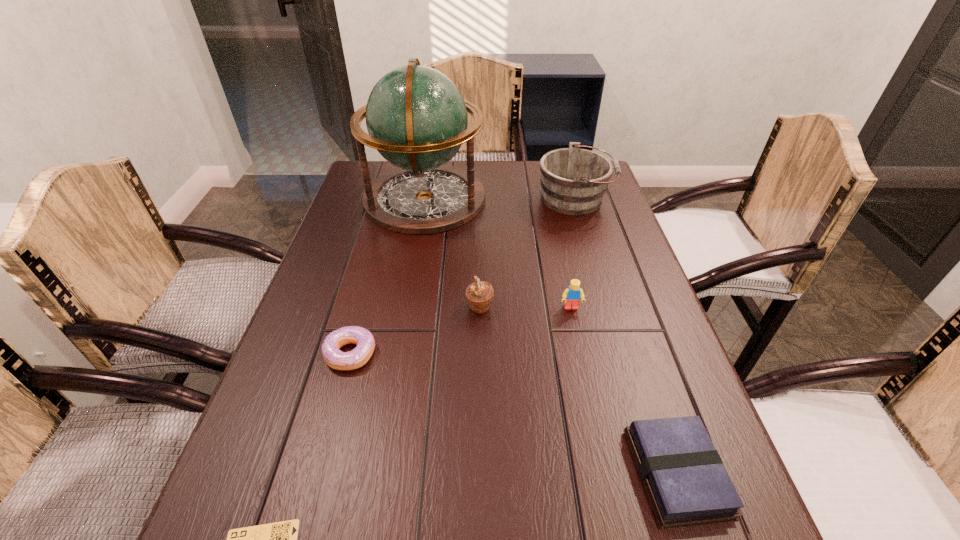
The image size is (960, 540). Find the location of `free area in between the book and the doughnut`. free area in between the book and the doughnut is located at coordinates (x=514, y=413).

Identify the location of free space between the fifth farthest object and the globe. The height and width of the screenshot is (540, 960). (388, 276).

The width and height of the screenshot is (960, 540). I want to click on vacant point located between the muffin and the tallest object, so click(x=452, y=253).

Identify the location of the sixth closest object to the identity card. This screenshot has height=540, width=960. (573, 180).

This screenshot has width=960, height=540. Identify the location of object that can be found as the closest to the identity card. (359, 356).

The height and width of the screenshot is (540, 960). I want to click on vacant space that satisfies the following two spatial constraints: 1. on the front-facing side of the Lego; 2. on the right side of the book, so tap(606, 473).

The height and width of the screenshot is (540, 960). I want to click on free spot that satisfies the following two spatial constraints: 1. on the back side of the doughnut; 2. on the left side of the muffin, so click(363, 307).

Find the location of `free space that satisfies the following two spatial constraints: 1. on the front-facing side of the tallest object; 2. on the front side of the fifth farthest object`. free space that satisfies the following two spatial constraints: 1. on the front-facing side of the tallest object; 2. on the front side of the fifth farthest object is located at coordinates (398, 354).

In order to click on vacant space that satisfies the following two spatial constraints: 1. on the front-facing side of the tallest object; 2. on the left side of the book in this screenshot , I will do `click(377, 473)`.

The width and height of the screenshot is (960, 540). In order to click on free space that satisfies the following two spatial constraints: 1. on the front-facing side of the globe; 2. on the left side of the muffin in this screenshot , I will do `click(406, 307)`.